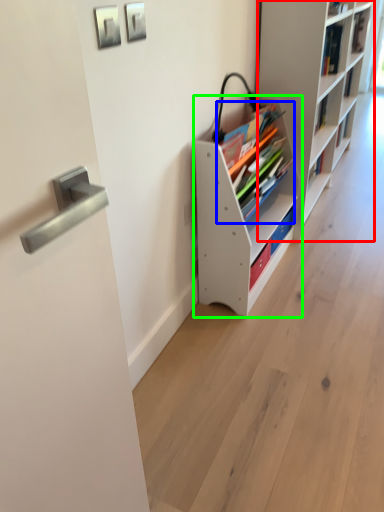
Question: Which object is positioned closest to shelf (highlighted by a red box)? Select from book (highlighted by a blue box) and shelf (highlighted by a green box).

Choices:
 (A) book
 (B) shelf

Answer: (B)